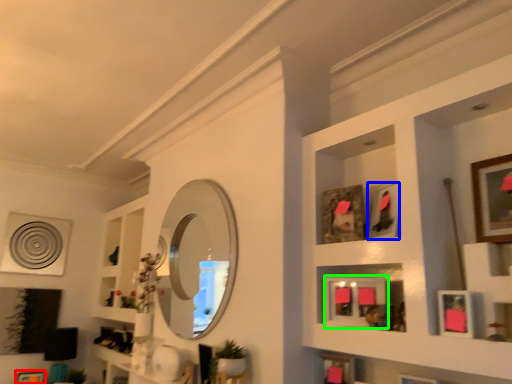
Question: Which object is positioned closest to picture frame (highlighted by a red box)? Select from picture frame (highlighted by a blue box) and picture frame (highlighted by a green box).

Choices:
 (A) picture frame
 (B) picture frame

Answer: (B)